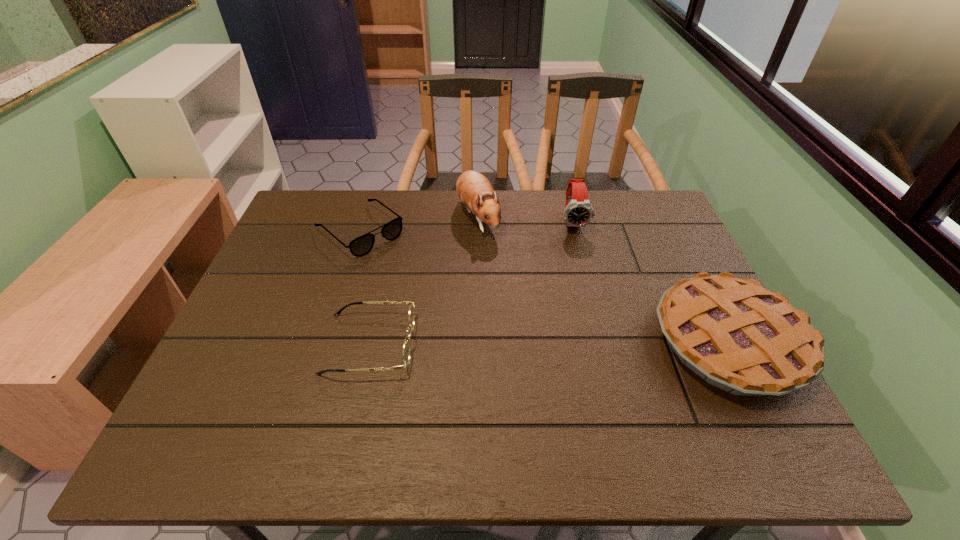
Select which object is the fourth closest to the watch. Please provide its 2D coordinates. Your answer should be formatted as a tuple, i.e. [(x, y)], where the tuple contains the x and y coordinates of a point satisfying the conditions above.

[(406, 347)]

Where is `vacant space that satisfies the following two spatial constraints: 1. on the front side of the second object from right to left; 2. on the left side of the third object from right to left`? Image resolution: width=960 pixels, height=540 pixels. vacant space that satisfies the following two spatial constraints: 1. on the front side of the second object from right to left; 2. on the left side of the third object from right to left is located at coordinates (478, 221).